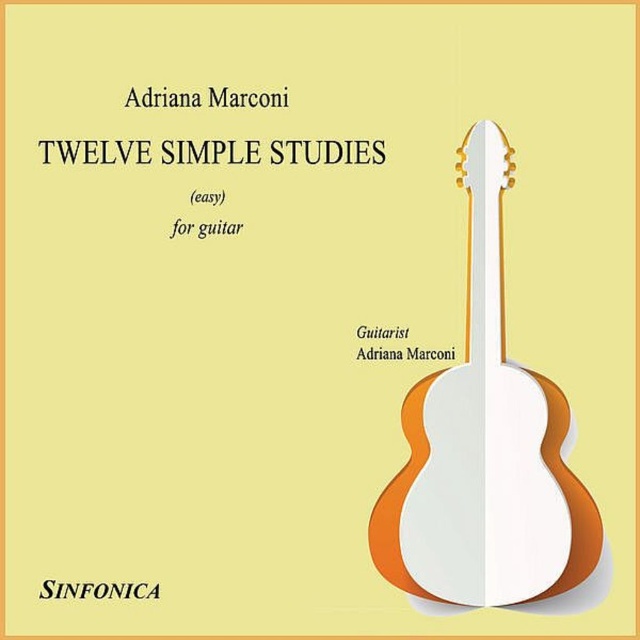
Question: Which of the following is the farthest from the observer?

Choices:
 (A) click(403, 337)
 (B) click(177, 228)

Answer: (A)

Question: Based on their relative distances, which object is farther from the black paper at upper center?

Choices:
 (A) white paper guitar at right
 (B) white glossy guitar at center
 (C) red paper for guitar at center
 (D) black text at upper center

Answer: (D)

Question: Is white paper guitar at right bigger than black paper at upper center?

Choices:
 (A) no
 (B) yes

Answer: (B)

Question: Can you confirm if black text at upper center is positioned above black paper at upper center?

Choices:
 (A) no
 (B) yes

Answer: (A)

Question: Among these points, which one is nearest to the camera?

Choices:
 (A) (371, 353)
 (B) (420, 452)
 (C) (92, 593)
 (D) (401, 336)

Answer: (C)

Question: From the image, what is the correct spatial relationship of white glossy guitar at center in relation to white paper guitar at right?

Choices:
 (A) below
 (B) above

Answer: (A)